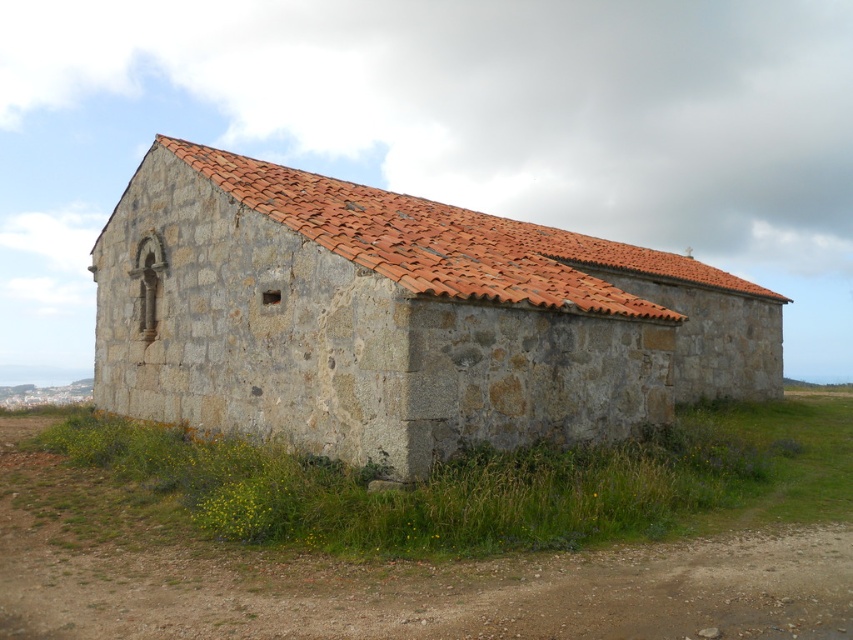
From the picture: You are a gardener who wants to plant a new flower bed between the green grass at lower right and the red clay tiles at upper center. Given that the recommended spacing for these flowers is 10 feet apart, will there be enough space to plant them in a straight line between these two points?

The distance between the green grass at lower right and the red clay tiles at upper center is 17.28 feet. Since the recommended spacing for the flowers is 10 feet apart, you can plant them in a straight line between these two points with sufficient space.

In the scene shown: You are a painter standing at the base of the stone textured barn at center, and you want to paint the red clay tiles at upper center. Can you reach them without a ladder?

The distance between the stone textured barn at center and the red clay tiles at upper center is 21.97 inches. Since this distance is the vertical height, a painter would need a ladder to reach the red clay tiles at upper center as they are out of arm reach.